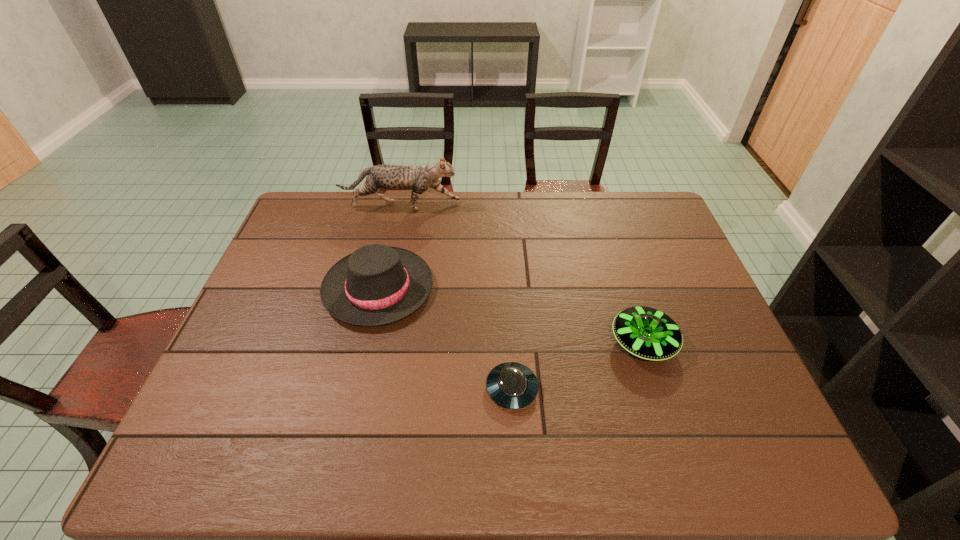
Where is `the tallest object`? The width and height of the screenshot is (960, 540). the tallest object is located at coordinates (380, 178).

Find the location of a particular element. Image resolution: width=960 pixels, height=540 pixels. the farthest object is located at coordinates 380,178.

The height and width of the screenshot is (540, 960). What are the coordinates of `dress hat` in the screenshot? It's located at (375, 285).

The width and height of the screenshot is (960, 540). What are the coordinates of `the taller saucer` in the screenshot? It's located at (648, 333).

You are a GUI agent. You are given a task and a screenshot of the screen. Output one action in this format:
    pyautogui.click(x=<x>, y=<y>)
    Task: Click on the right saucer
    The image size is (960, 540).
    Given the screenshot: What is the action you would take?
    pyautogui.click(x=648, y=333)

You are a GUI agent. You are given a task and a screenshot of the screen. Output one action in this format:
    pyautogui.click(x=<x>, y=<y>)
    Task: Click on the left saucer
    
    Given the screenshot: What is the action you would take?
    pyautogui.click(x=512, y=385)

I want to click on the second object from right to left, so click(512, 385).

Locate an element on the screen. free space located 0.340m on the face of the cat is located at coordinates (555, 206).

Where is `free location located on the front of the second tallest object`? The image size is (960, 540). free location located on the front of the second tallest object is located at coordinates (342, 453).

Find the location of `vacant space situated on the left of the taller saucer`. vacant space situated on the left of the taller saucer is located at coordinates (485, 342).